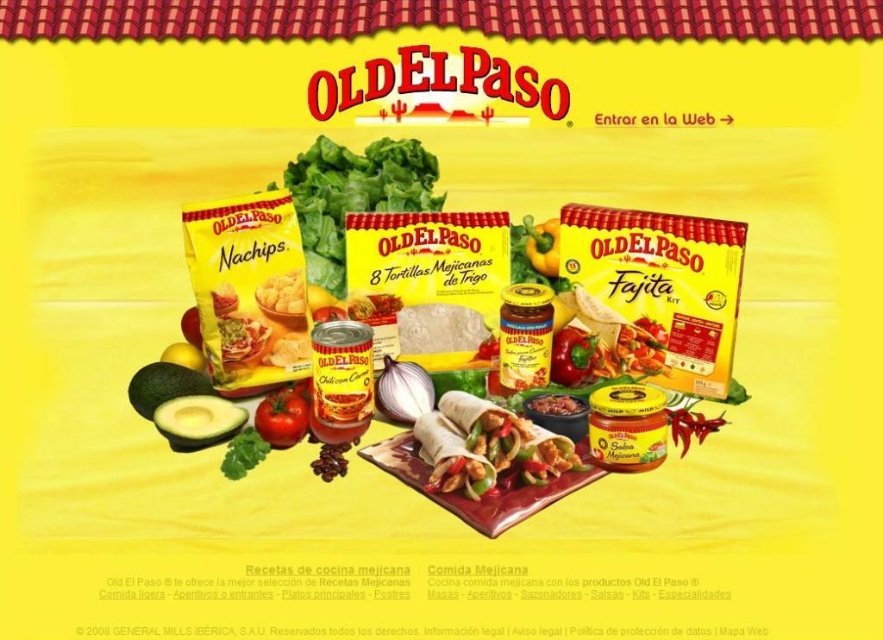
You are looking at the Old El Paso advertisement and notice the green leafy lettuce at center and the red smooth tomato at center. Which of these two items is positioned closer to the front of the arrangement?

The green leafy lettuce at center is positioned closer to the front because the red smooth tomato at center is behind it.

Looking at the Old El Paso advertisement, you notice the green leafy lettuce at center and the red smooth tomato at center. Which of these two items is bigger?

The green leafy lettuce at center is larger in size compared to the red smooth tomato at center.